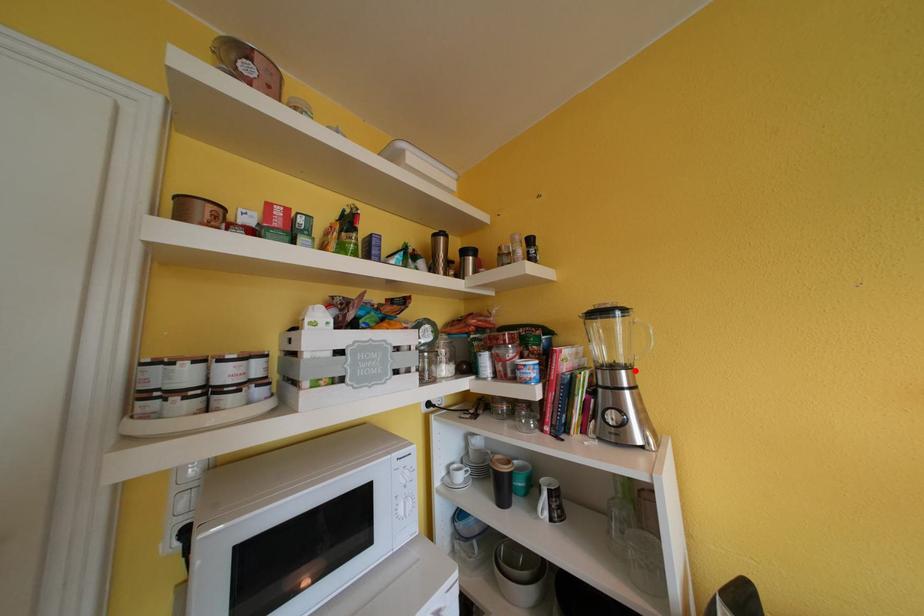
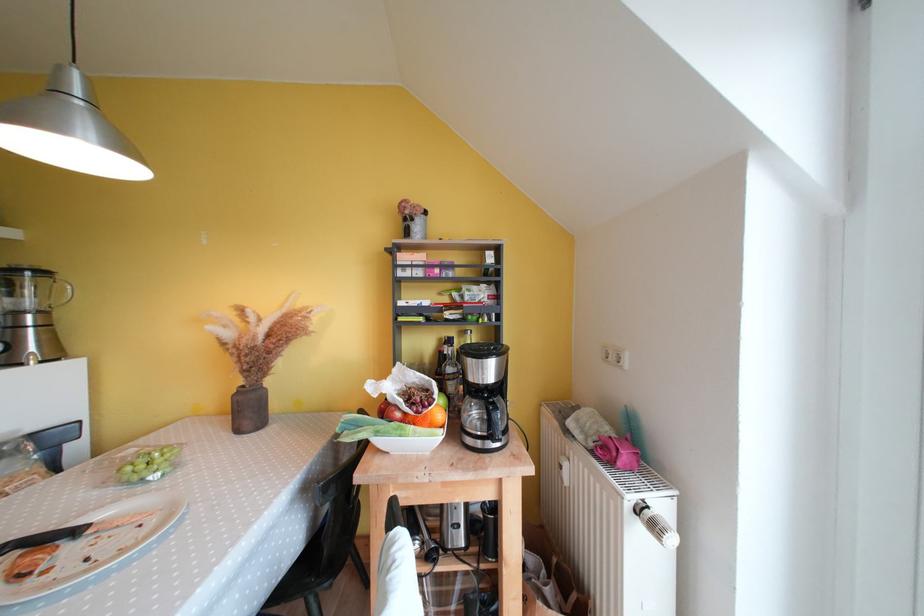
In the second image, find the point that corresponds to the highlighted location in the first image.

(49, 315)